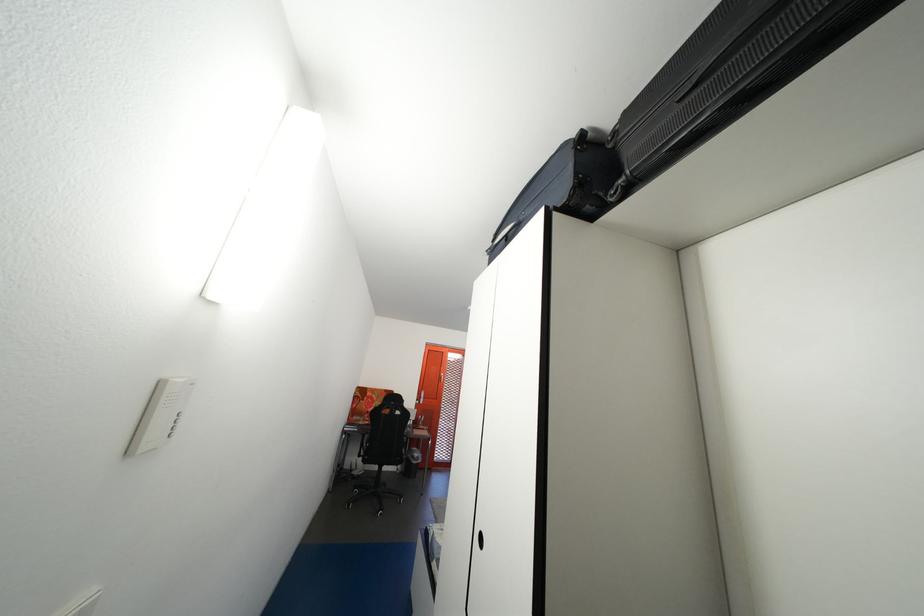
Where would you press the white panel button? Please return your answer as a coordinate pair (x, y).

(161, 415)